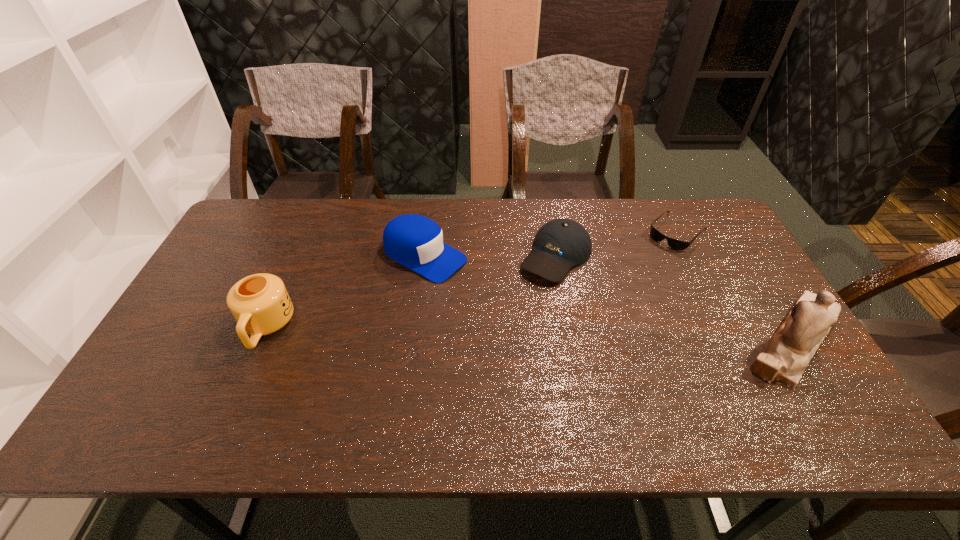
Identify the location of the second tallest object. (260, 303).

Find the location of `the leftmost object`. the leftmost object is located at coordinates (260, 303).

Where is `figurine`? The height and width of the screenshot is (540, 960). figurine is located at coordinates point(785,358).

What are the coordinates of `sunglasses` in the screenshot? It's located at (676, 244).

Where is `the shorter baseball cap`? This screenshot has height=540, width=960. the shorter baseball cap is located at coordinates (560, 244).

The height and width of the screenshot is (540, 960). In order to click on the third object from right to left in this screenshot , I will do click(560, 244).

You are a GUI agent. You are given a task and a screenshot of the screen. Output one action in this format:
    pyautogui.click(x=<x>, y=<y>)
    Task: Click on the second object from left to right
    
    Given the screenshot: What is the action you would take?
    pyautogui.click(x=414, y=241)

The height and width of the screenshot is (540, 960). I want to click on the third tallest object, so click(414, 241).

The height and width of the screenshot is (540, 960). In order to click on free space located on the handle side of the mug in this screenshot , I will do `click(243, 381)`.

Where is `blank space located on the front-facing side of the sunglasses`? blank space located on the front-facing side of the sunglasses is located at coordinates (619, 291).